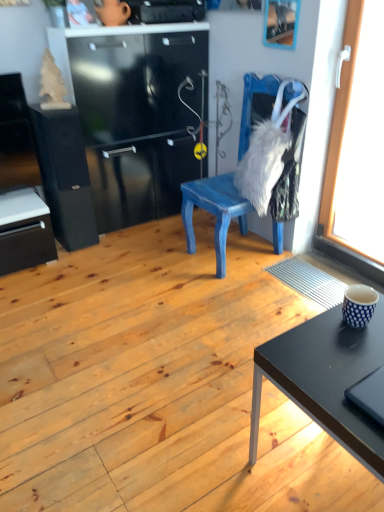
Locate an element on the screen. Image resolution: width=384 pixels, height=512 pixels. free space that is in between blue dotted cup at right and black matte laptop at lower right is located at coordinates click(357, 350).